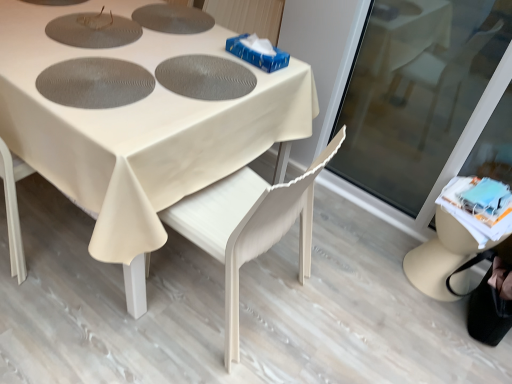
Where is `white fabric table at center`? The width and height of the screenshot is (512, 384). white fabric table at center is located at coordinates (140, 121).

In order to click on white wood chair at center in this screenshot , I will do [x=248, y=225].

What do you see at coordinates (416, 92) in the screenshot? The height and width of the screenshot is (384, 512). I see `transparent glass screen door at lower right` at bounding box center [416, 92].

Where is `white fabric table at center`? Image resolution: width=512 pixels, height=384 pixels. white fabric table at center is located at coordinates (140, 121).

Considering the relative sizes of white fabric table at center and white wood chair at center in the image provided, is white fabric table at center smaller than white wood chair at center?

No, white fabric table at center is not smaller than white wood chair at center.

Based on the photo, is white fabric table at center taller or shorter than white wood chair at center?

white fabric table at center is shorter than white wood chair at center.

Is white fabric table at center not inside white wood chair at center?

Yes, white fabric table at center is located beyond the bounds of white wood chair at center.

Could you tell me if white fabric table at center is turned towards transparent glass screen door at lower right?

No, white fabric table at center is not turned towards transparent glass screen door at lower right.

From a real-world perspective, does white fabric table at center sit lower than transparent glass screen door at lower right?

Yes, from a real-world perspective, white fabric table at center is under transparent glass screen door at lower right.

In the image, there is a transparent glass screen door at lower right. Where is `table above it (from the image's perspective)`? The width and height of the screenshot is (512, 384). table above it (from the image's perspective) is located at coordinates (140, 121).

Can you confirm if white wood chair at center is taller than white fabric table at center?

Yes, white wood chair at center is taller than white fabric table at center.

Identify the location of chair above the white fabric table at center (from a real-world perspective). (248, 225).

In the scene shown: Which object is closer to the camera taking this photo, white wood chair at center or white fabric table at center?

white fabric table at center is closer to the camera.

Consider the image. From a real-world perspective, is white wood chair at center physically above white fabric table at center?

Yes.

Is transparent glass screen door at lower right not within white wood chair at center?

That's correct, transparent glass screen door at lower right is outside of white wood chair at center.

Looking at this image, which is behind, transparent glass screen door at lower right or white wood chair at center?

Positioned behind is transparent glass screen door at lower right.

From the image's perspective, which is above, transparent glass screen door at lower right or white wood chair at center?

From the image's view, transparent glass screen door at lower right is above.

From a real-world perspective, is transparent glass screen door at lower right above or below white wood chair at center?

transparent glass screen door at lower right is situated higher than white wood chair at center in the real world.

Is transparent glass screen door at lower right looking in the opposite direction of white fabric table at center?

No, transparent glass screen door at lower right is not facing away from white fabric table at center.

Are transparent glass screen door at lower right and white fabric table at center making contact?

No, transparent glass screen door at lower right is not in contact with white fabric table at center.

From a real-world perspective, between transparent glass screen door at lower right and white fabric table at center, who is vertically higher?

transparent glass screen door at lower right, from a real-world perspective.

Which point is more forward, (357, 167) or (228, 101)?

Point (228, 101)

From the image's perspective, is white wood chair at center on transparent glass screen door at lower right?

No, from the image's perspective, white wood chair at center is not over transparent glass screen door at lower right.

Is white wood chair at center with transparent glass screen door at lower right?

There is a gap between white wood chair at center and transparent glass screen door at lower right.

In terms of size, does white wood chair at center appear bigger or smaller than transparent glass screen door at lower right?

Clearly, white wood chair at center is larger in size than transparent glass screen door at lower right.

Locate an element on the screen. The height and width of the screenshot is (384, 512). chair behind the white fabric table at center is located at coordinates (248, 225).

I want to click on table beneath the transparent glass screen door at lower right (from a real-world perspective), so (x=140, y=121).

Consider the image. Considering their positions, is white wood chair at center positioned closer to white fabric table at center than transparent glass screen door at lower right?

white wood chair at center lies closer to white fabric table at center than the other object.

Considering their positions, is transparent glass screen door at lower right positioned further to white wood chair at center than white fabric table at center?

transparent glass screen door at lower right.

From the image, which object appears to be farther from transparent glass screen door at lower right, white wood chair at center or white fabric table at center?

white fabric table at center.

Estimate the real-world distances between objects in this image. Which object is further from transparent glass screen door at lower right, white fabric table at center or white wood chair at center?

Result: white fabric table at center lies further to transparent glass screen door at lower right than the other object.

Looking at this image, estimate the real-world distances between objects in this image. Which object is closer to white wood chair at center, white fabric table at center or transparent glass screen door at lower right?

Based on the image, white fabric table at center appears to be nearer to white wood chair at center.

Estimate the real-world distances between objects in this image. Which object is further from white fabric table at center, transparent glass screen door at lower right or white wood chair at center?

Among the two, transparent glass screen door at lower right is located further to white fabric table at center.

This screenshot has width=512, height=384. I want to click on chair between white fabric table at center and transparent glass screen door at lower right from left to right, so click(x=248, y=225).